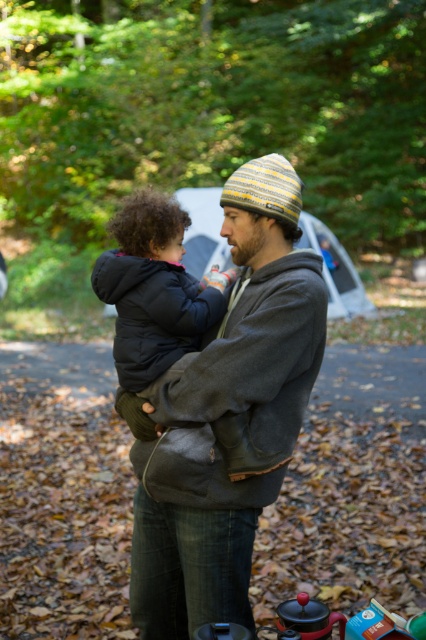
Between gray fleece hoodie at center and dark gray puffy coat at center, which one appears on the right side from the viewer's perspective?

Positioned to the right is gray fleece hoodie at center.

Is gray fleece hoodie at center taller than dark gray puffy coat at center?

Indeed, gray fleece hoodie at center has a greater height compared to dark gray puffy coat at center.

Who is more distant from viewer, (227, 568) or (138, 241)?

The point (138, 241) is more distant.

Locate an element on the screen. gray fleece hoodie at center is located at coordinates (226, 416).